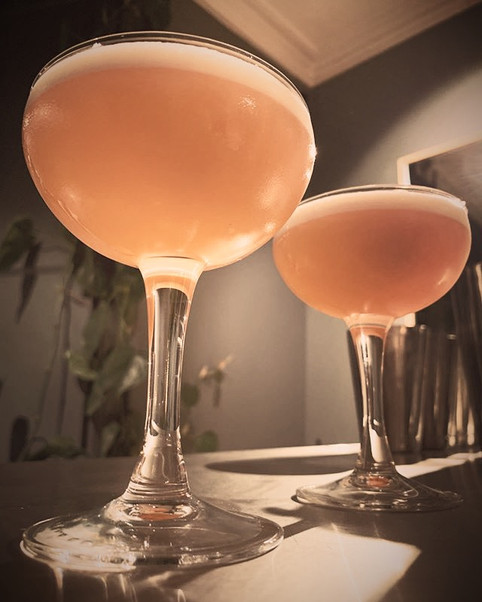
At what (x,y) coordinates should I click in order to perform the action: click on bar table. Please return your answer as a coordinate pair (x, y). Looking at the image, I should click on (365, 548).